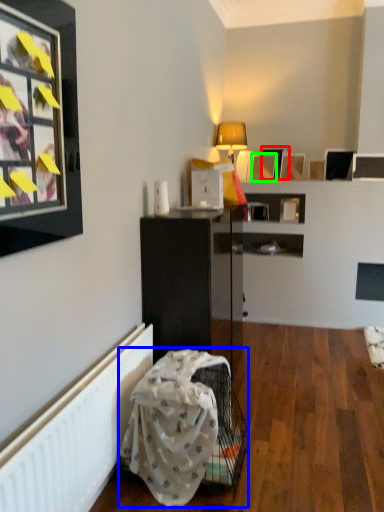
Question: Which object is positioned farthest from picture frame (highlighted by a red box)? Select from swivel chair (highlighted by a blue box) and picture frame (highlighted by a green box).

Choices:
 (A) swivel chair
 (B) picture frame

Answer: (A)